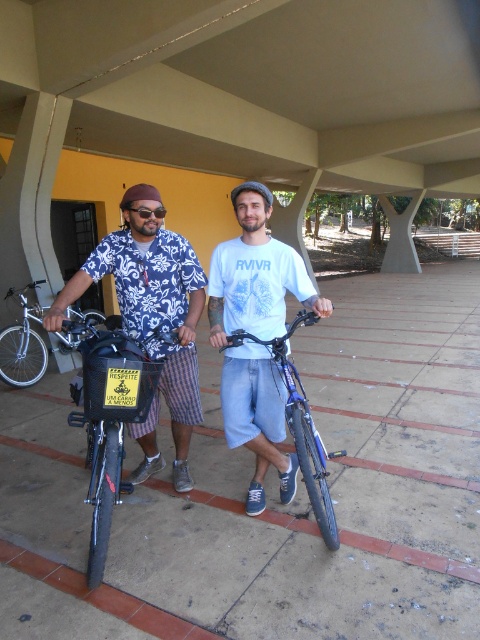
Question: Where is patterned fabric shirt at center located in relation to silver metallic bicycle at left in the image?

Choices:
 (A) below
 (B) above

Answer: (A)

Question: Which point appears farthest from the camera in this image?

Choices:
 (A) (466, 355)
 (B) (136, 296)
 (C) (117, 401)
 (D) (280, 355)

Answer: (A)

Question: Does blue metallic bicycle at center come behind silver metallic bicycle at left?

Choices:
 (A) no
 (B) yes

Answer: (A)

Question: Which object is farther from the camera taking this photo?

Choices:
 (A) black matte bicycle at left
 (B) brown concrete pavement at center
 (C) silver metallic bicycle at left

Answer: (C)

Question: Does white cotton t-shirt at center appear on the left side of black matte bicycle at left?

Choices:
 (A) no
 (B) yes

Answer: (A)

Question: Which is nearer to the silver metallic bicycle at left?

Choices:
 (A) black matte bicycle at left
 (B) brown concrete pavement at center

Answer: (B)